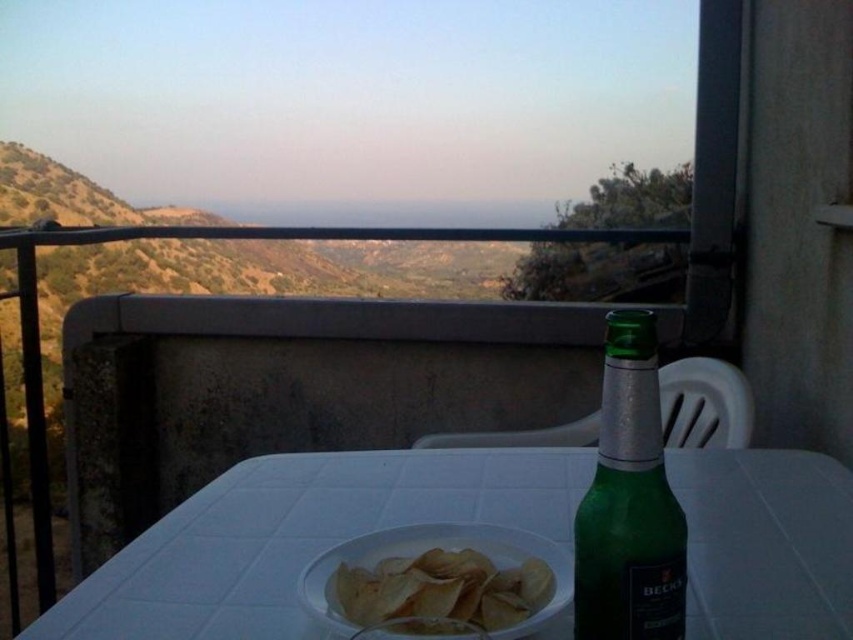
Consider the image. Is white plastic table at center to the right of green glass bottle at center right from the viewer's perspective?

In fact, white plastic table at center is to the left of green glass bottle at center right.

Does white plastic table at center have a larger size compared to green glass bottle at center right?

Yes, white plastic table at center is bigger than green glass bottle at center right.

Is point (70, 609) positioned in front of point (593, 513)?

That is False.

Find the location of `white plastic table at center`. white plastic table at center is located at coordinates 300,536.

Can you confirm if green glass bottle at center right is smaller than golden crispy chips at center?

Actually, green glass bottle at center right might be larger than golden crispy chips at center.

What do you see at coordinates (630, 502) in the screenshot? I see `green glass bottle at center right` at bounding box center [630, 502].

Which is in front, point (583, 580) or point (413, 582)?

Point (583, 580) is more forward.

Locate an element on the screen. The image size is (853, 640). green glass bottle at center right is located at coordinates pyautogui.click(x=630, y=502).

Who is lower down, white plastic table at center or golden crispy chips at center?

white plastic table at center is lower down.

Between white plastic table at center and golden crispy chips at center, which one is positioned higher?

golden crispy chips at center

Who is more distant from viewer, (x=416, y=458) or (x=416, y=570)?

Positioned behind is point (x=416, y=458).

Locate an element on the screen. Image resolution: width=853 pixels, height=640 pixels. white plastic table at center is located at coordinates (300, 536).